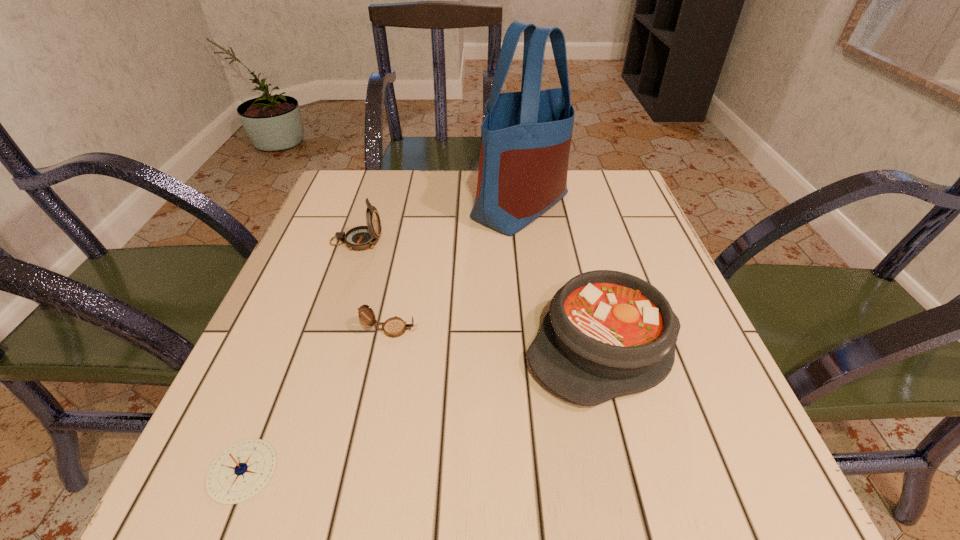
What are the coordinates of `the tallest object` in the screenshot? It's located at (526, 136).

Identify the location of the tallest compass. click(359, 238).

Identify the location of casserole. (607, 334).

Image resolution: width=960 pixels, height=540 pixels. In order to click on the second nearest compass in this screenshot , I will do `click(393, 327)`.

At what (x,y) coordinates should I click in order to perform the action: click on the third object from right to left. Please return your answer as a coordinate pair (x, y). This screenshot has width=960, height=540. Looking at the image, I should click on (393, 327).

Locate an element on the screen. the nearest object is located at coordinates (241, 471).

Find the location of `vacant region located on the front of the tallest object`. vacant region located on the front of the tallest object is located at coordinates [529, 269].

I want to click on blank area located 0.150m on the face of the tallest compass, so click(450, 241).

The image size is (960, 540). What are the coordinates of `vacant area situated 0.340m on the back of the casserole` in the screenshot? It's located at (564, 199).

This screenshot has height=540, width=960. What are the coordinates of `free space located 0.210m on the face of the second nearest compass` in the screenshot? It's located at tap(536, 329).